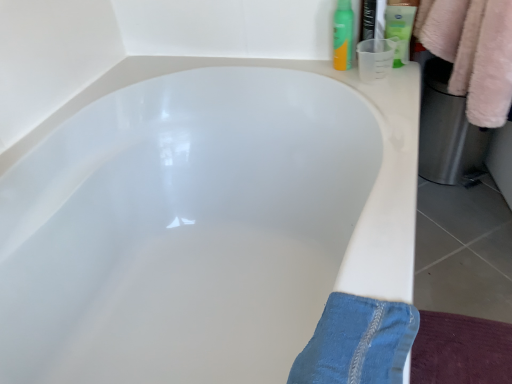
This screenshot has width=512, height=384. What are the coordinates of `free point in front of green matte lotion at upper right, acting as the second toiletry starting from the left` in the screenshot? It's located at (390, 84).